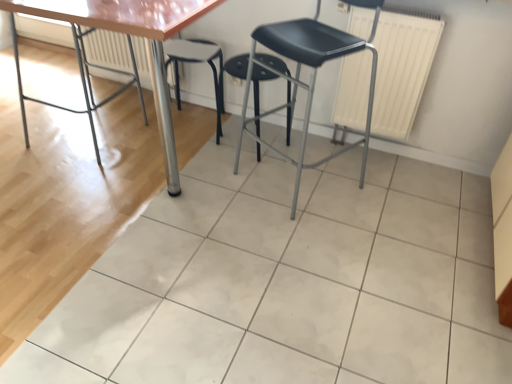
The image size is (512, 384). Identify the location of vacant area situated to the left side of metallic polished table at left. (30, 121).